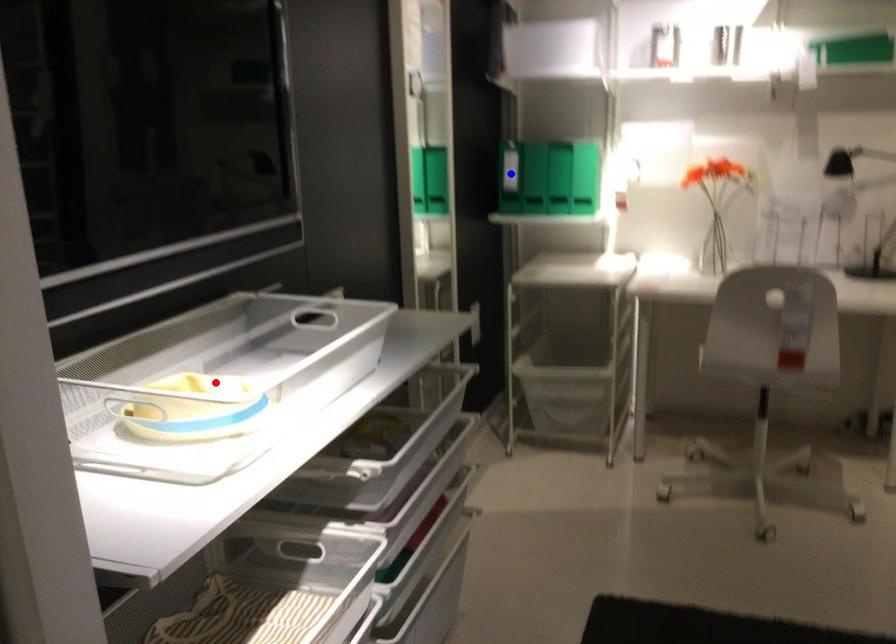
Question: In the image, two points are highlighted. Which point is nearer to the camera? Reply with the corresponding letter.

Choices:
 (A) blue point
 (B) red point

Answer: (B)